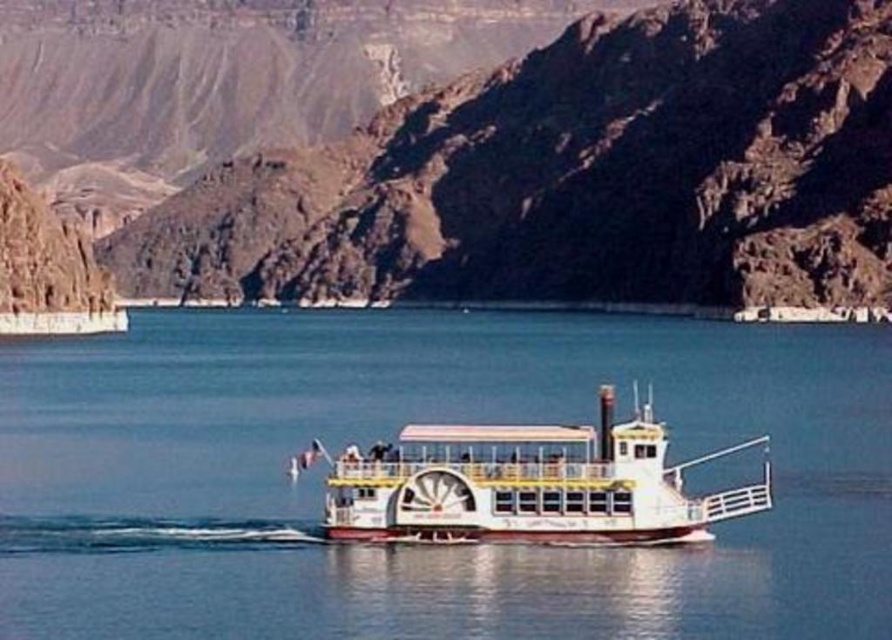
Is brown rocky mountain at center to the left of white polished wood cruise ship at center from the viewer's perspective?

No, brown rocky mountain at center is not to the left of white polished wood cruise ship at center.

How much distance is there between brown rocky mountain at center and white polished wood cruise ship at center?

brown rocky mountain at center and white polished wood cruise ship at center are 598.56 feet apart.

Where is `brown rocky mountain at center`? This screenshot has width=892, height=640. brown rocky mountain at center is located at coordinates (464, 147).

Which is below, brown rocky mountain at center or white glossy water at center?

Positioned lower is white glossy water at center.

Does brown rocky mountain at center appear under white glossy water at center?

No.

Is point (308, 200) positioned behind point (37, 467)?

That is True.

This screenshot has width=892, height=640. I want to click on brown rocky mountain at center, so click(464, 147).

Does white glossy water at center have a lesser width compared to white polished wood cruise ship at center?

In fact, white glossy water at center might be wider than white polished wood cruise ship at center.

Does white glossy water at center have a larger size compared to white polished wood cruise ship at center?

Yes.

This screenshot has height=640, width=892. I want to click on white glossy water at center, so click(x=392, y=438).